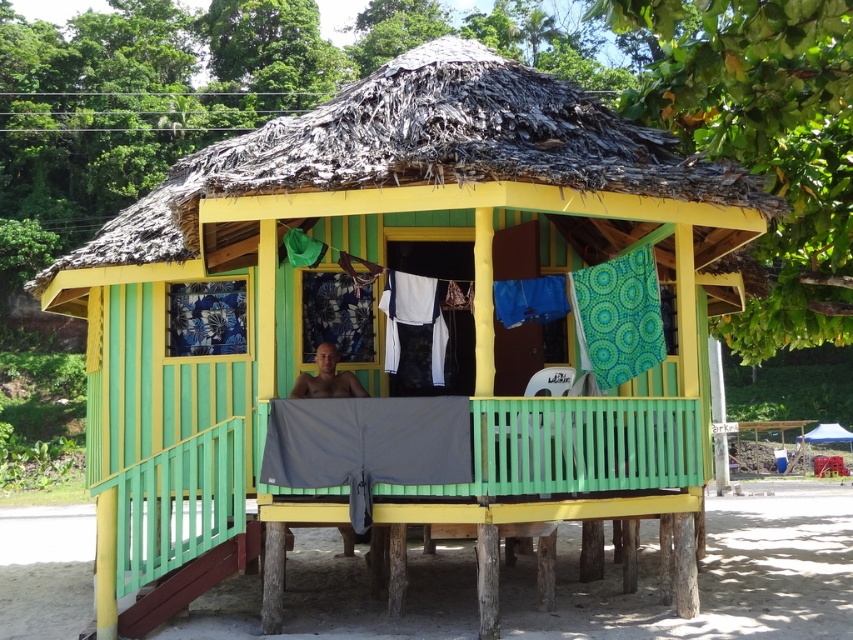
Is smooth skin man at center closer to the viewer compared to blue fabric canopy at upper right?

Yes, smooth skin man at center is closer to the viewer.

Looking at this image, can you confirm if smooth skin man at center is taller than blue fabric canopy at upper right?

Yes.

Image resolution: width=853 pixels, height=640 pixels. Find the location of `smooth skin man at center`. smooth skin man at center is located at coordinates (328, 378).